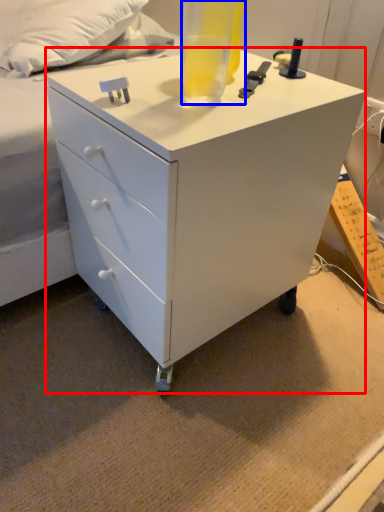
Question: Among these objects, which one is nearest to the camera, chest of drawers (highlighted by a red box) or beverage (highlighted by a blue box)?

Choices:
 (A) chest of drawers
 (B) beverage

Answer: (B)